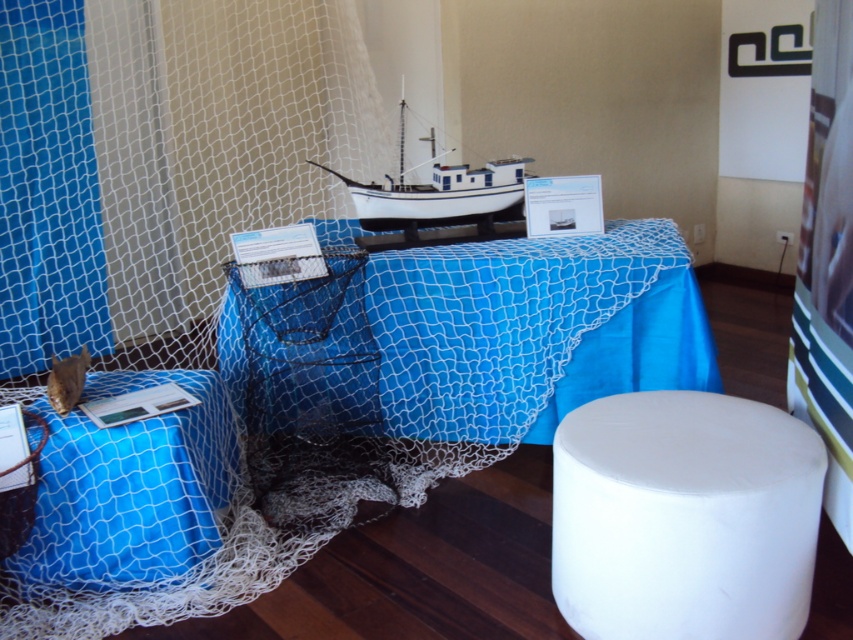
Question: Which point is closer to the camera taking this photo?

Choices:
 (A) (776, 433)
 (B) (480, 330)
 (C) (486, 358)

Answer: (A)

Question: Does white matte stool at lower right have a smaller size compared to blue netting at lower left?

Choices:
 (A) no
 (B) yes

Answer: (A)

Question: Does white matte stool at lower right have a lesser width compared to white matte boat at center?

Choices:
 (A) no
 (B) yes

Answer: (B)

Question: Which object is farther from the camera taking this photo?

Choices:
 (A) white matte stool at lower right
 (B) blue satin tablecloth at center
 (C) white matte boat at center
 (D) blue netting at lower left

Answer: (C)

Question: Is blue netting tablecloth at center further to the viewer compared to blue satin tablecloth at center?

Choices:
 (A) yes
 (B) no

Answer: (B)

Question: Which point is closer to the camera?

Choices:
 (A) (653, 502)
 (B) (426, 298)
 (C) (476, 252)

Answer: (A)